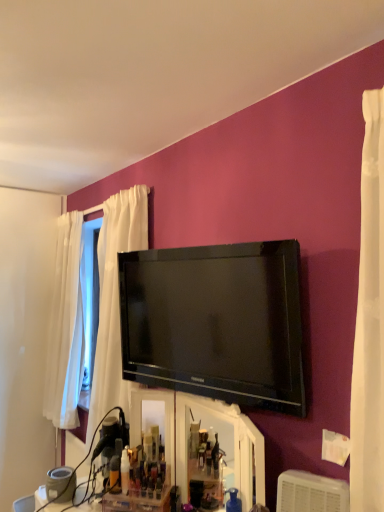
Question: Considering the relative positions of translucent plastic bottle at center and white plastic air conditioner at lower right in the image provided, is translucent plastic bottle at center behind white plastic air conditioner at lower right?

Choices:
 (A) no
 (B) yes

Answer: (B)

Question: From the image's perspective, would you say translucent plastic bottle at center is shown under white plastic air conditioner at lower right?

Choices:
 (A) no
 (B) yes

Answer: (B)

Question: Is translucent plastic bottle at center closer to the viewer compared to white plastic air conditioner at lower right?

Choices:
 (A) yes
 (B) no

Answer: (B)

Question: Is white plastic air conditioner at lower right surrounded by translucent plastic bottle at center?

Choices:
 (A) no
 (B) yes

Answer: (A)

Question: Can you confirm if translucent plastic bottle at center is taller than white plastic air conditioner at lower right?

Choices:
 (A) yes
 (B) no

Answer: (B)

Question: Does translucent plastic bottle at center have a lesser width compared to white plastic air conditioner at lower right?

Choices:
 (A) no
 (B) yes

Answer: (B)

Question: From the image's perspective, is white plastic air conditioner at lower right on top of translucent plastic bottle at center?

Choices:
 (A) yes
 (B) no

Answer: (A)

Question: Does white plastic air conditioner at lower right turn towards translucent plastic bottle at center?

Choices:
 (A) yes
 (B) no

Answer: (B)

Question: Is translucent plastic bottle at center inside white plastic air conditioner at lower right?

Choices:
 (A) yes
 (B) no

Answer: (B)

Question: Is white plastic air conditioner at lower right facing away from translucent plastic bottle at center?

Choices:
 (A) yes
 (B) no

Answer: (B)

Question: From a real-world perspective, is white plastic air conditioner at lower right located higher than translucent plastic bottle at center?

Choices:
 (A) no
 (B) yes

Answer: (B)

Question: Considering the relative sizes of white plastic air conditioner at lower right and translucent plastic bottle at center in the image provided, is white plastic air conditioner at lower right wider than translucent plastic bottle at center?

Choices:
 (A) no
 (B) yes

Answer: (B)

Question: From the image's perspective, is black glossy tv at upper center beneath white plastic air conditioner at lower right?

Choices:
 (A) yes
 (B) no

Answer: (B)